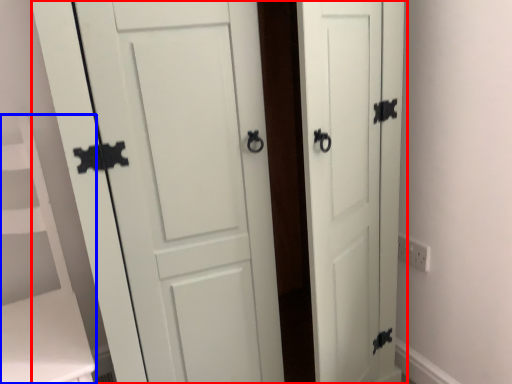
Question: Which object is further to the camera taking this photo, door (highlighted by a red box) or vanity (highlighted by a blue box)?

Choices:
 (A) door
 (B) vanity

Answer: (B)